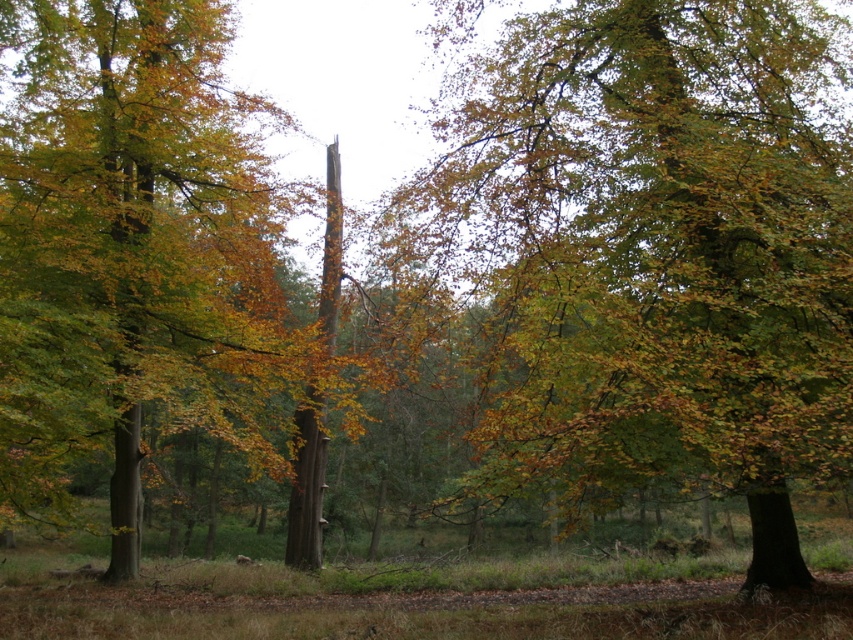
Question: Which of the following is the farthest from the observer?

Choices:
 (A) green leafy tree at left
 (B) green leafy tree at center

Answer: (A)

Question: Can you confirm if green leafy tree at center is positioned below green leafy tree at left?

Choices:
 (A) yes
 (B) no

Answer: (A)

Question: Which point is closer to the camera taking this photo?

Choices:
 (A) (125, 534)
 (B) (567, 70)

Answer: (B)

Question: Does green leafy tree at center appear on the right side of green leafy tree at left?

Choices:
 (A) no
 (B) yes

Answer: (B)

Question: Is green leafy tree at center bigger than green leafy tree at left?

Choices:
 (A) yes
 (B) no

Answer: (A)